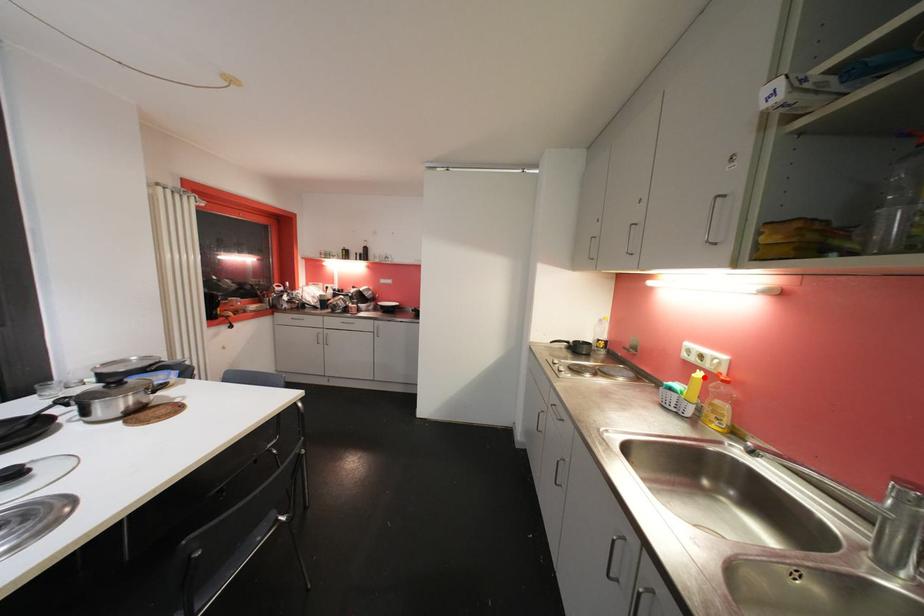
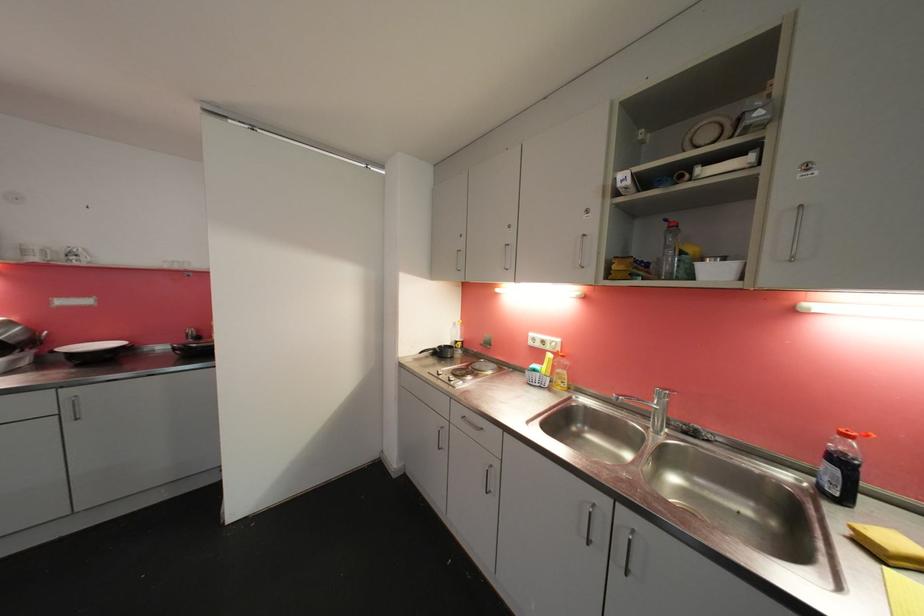
The point at the highlighted location is marked in the first image. Where is the corresponding point in the second image?

(554, 358)